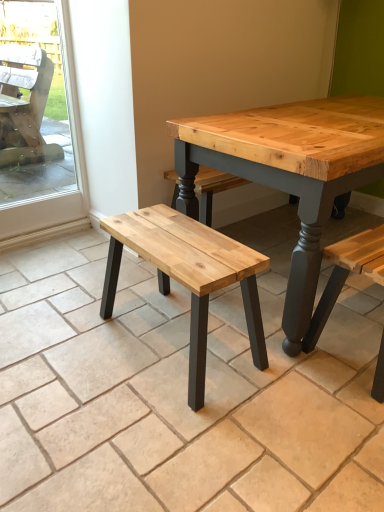
Where is `free point above natural wood bench at center (from a real-world perspective)`? This screenshot has width=384, height=512. free point above natural wood bench at center (from a real-world perspective) is located at coordinates (176, 234).